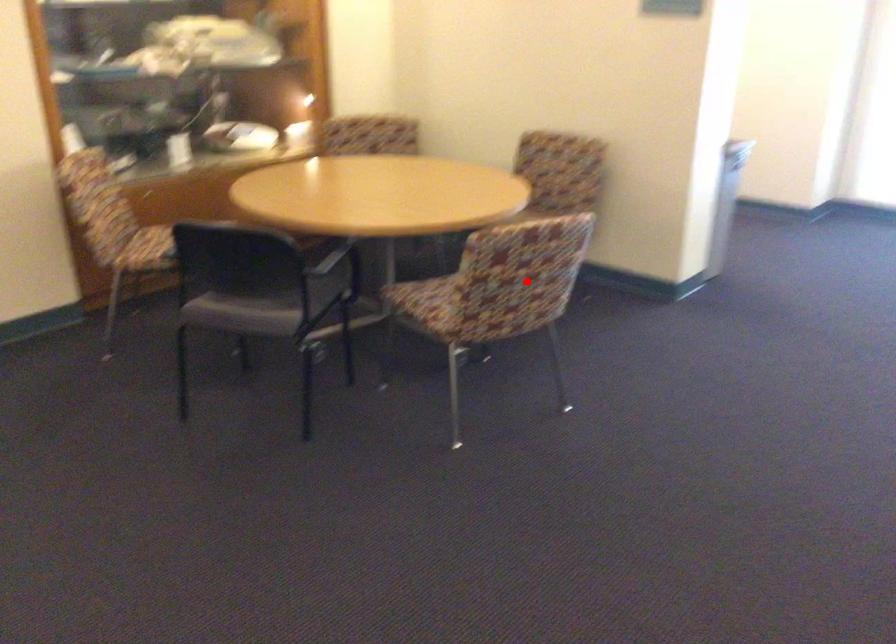
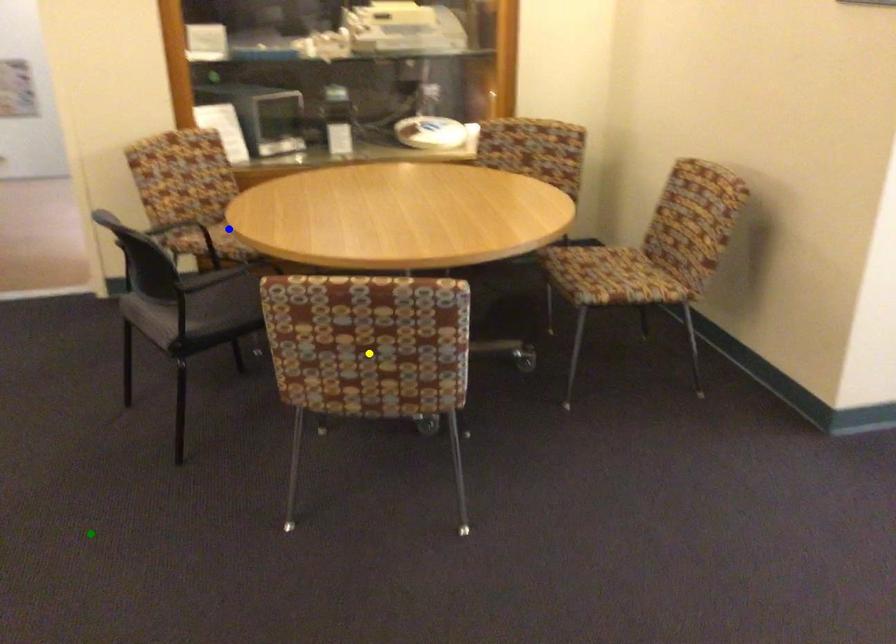
Question: I am providing you with two images of the same scene from different viewpoints. A red point is marked on the first image. You are given multiple points on the second image. Can you choose the point in image 2 that corresponds to the point in image 1?

Choices:
 (A) blue point
 (B) green point
 (C) yellow point

Answer: (C)